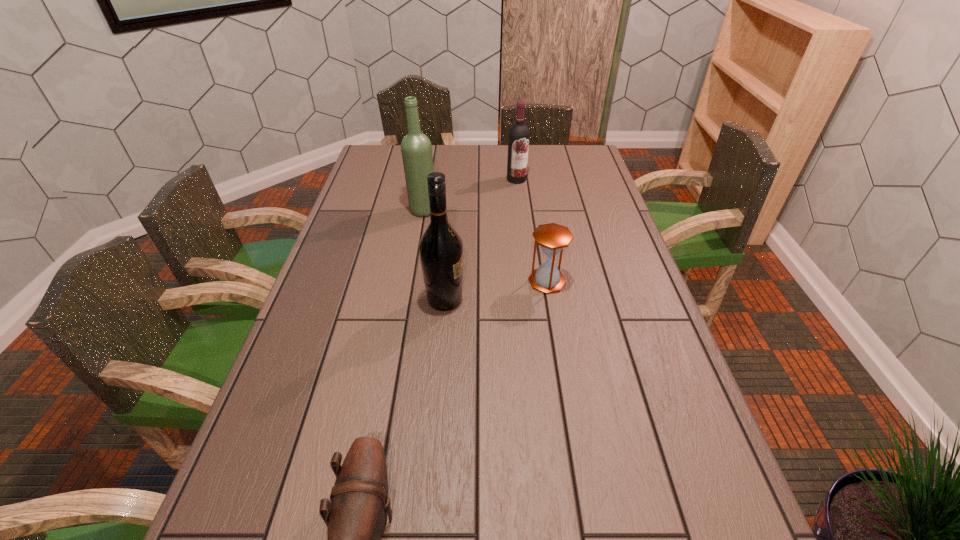
Identify the location of the second nearest wine bottle. (416, 148).

Identify the location of the nearest wine bottle. Image resolution: width=960 pixels, height=540 pixels. (441, 248).

Find the location of a particular element. The height and width of the screenshot is (540, 960). the shortest wine bottle is located at coordinates coord(518,141).

You are a GUI agent. You are given a task and a screenshot of the screen. Output one action in this format:
    pyautogui.click(x=<x>, y=<y>)
    Task: Click on the farthest object
    This screenshot has width=960, height=540.
    Given the screenshot: What is the action you would take?
    pyautogui.click(x=518, y=141)

Where is `hourglass`? hourglass is located at coordinates (552, 238).

At what (x,y) coordinates should I click in order to perform the action: click on free region located on the left of the fourth nearest object. Please return your answer as a coordinate pair (x, y). Looking at the image, I should click on (365, 210).

Image resolution: width=960 pixels, height=540 pixels. In order to click on free region located on the label of the nearest wine bottle in this screenshot , I will do `click(576, 300)`.

Locate an element on the screen. The height and width of the screenshot is (540, 960). vacant space positioned 0.060m on the label of the third tallest object is located at coordinates (518, 193).

The image size is (960, 540). Identify the location of blank area located on the left of the hourglass. (429, 281).

Identify the location of vacant space at the far edge of the desktop. The width and height of the screenshot is (960, 540). (444, 154).